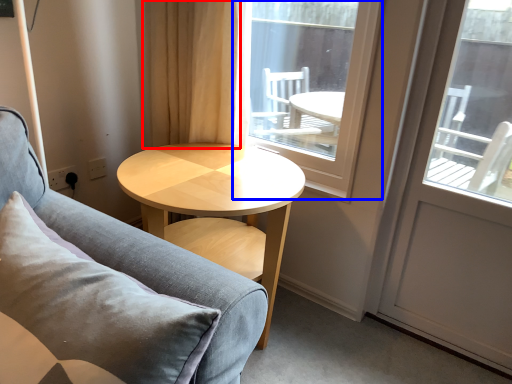
Question: Among these objects, which one is nearest to the camera, curtain (highlighted by a red box) or window (highlighted by a blue box)?

Choices:
 (A) curtain
 (B) window

Answer: (B)